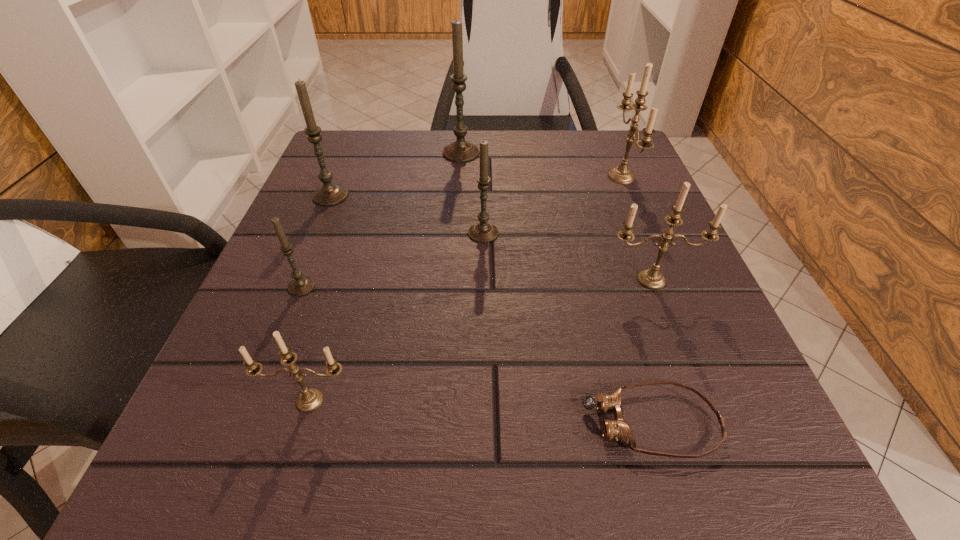
Where is `the biggest gray candle`? the biggest gray candle is located at coordinates (460, 150).

Identify the location of the farthest gray candle. (460, 150).

Locate an element on the screen. This screenshot has height=540, width=960. the farthest metallic candle is located at coordinates (623, 175).

Locate an element on the screen. The width and height of the screenshot is (960, 540). the second farthest gray candle is located at coordinates (329, 194).

Locate an element on the screen. Image resolution: width=960 pixels, height=540 pixels. the second smallest gray candle is located at coordinates (483, 232).

You are a GUI agent. You are given a task and a screenshot of the screen. Output one action in this format:
    pyautogui.click(x=<x>, y=<y>)
    Task: Click on the fifth nearest object
    The height and width of the screenshot is (540, 960).
    Given the screenshot: What is the action you would take?
    pyautogui.click(x=483, y=232)

Locate an element on the screen. This screenshot has height=540, width=960. the second biggest metallic candle is located at coordinates (652, 279).

This screenshot has width=960, height=540. I want to click on the nearest gray candle, so click(300, 286).

What are the coordinates of `the smallest metallic candle` in the screenshot? It's located at (310, 399).

You are a GUI agent. You are given a task and a screenshot of the screen. Output one action in this format:
    pyautogui.click(x=<x>, y=<y>)
    Task: Click on the leftmost metallic candle
    The width and height of the screenshot is (960, 540).
    Given the screenshot: What is the action you would take?
    pyautogui.click(x=310, y=399)